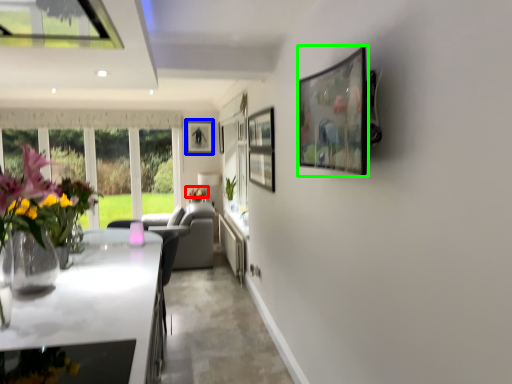
Question: Estimate the real-world distances between objects in this image. Which object is closer to flower (highlighted by a red box), picture frame (highlighted by a blue box) or picture frame (highlighted by a green box)?

Choices:
 (A) picture frame
 (B) picture frame

Answer: (A)